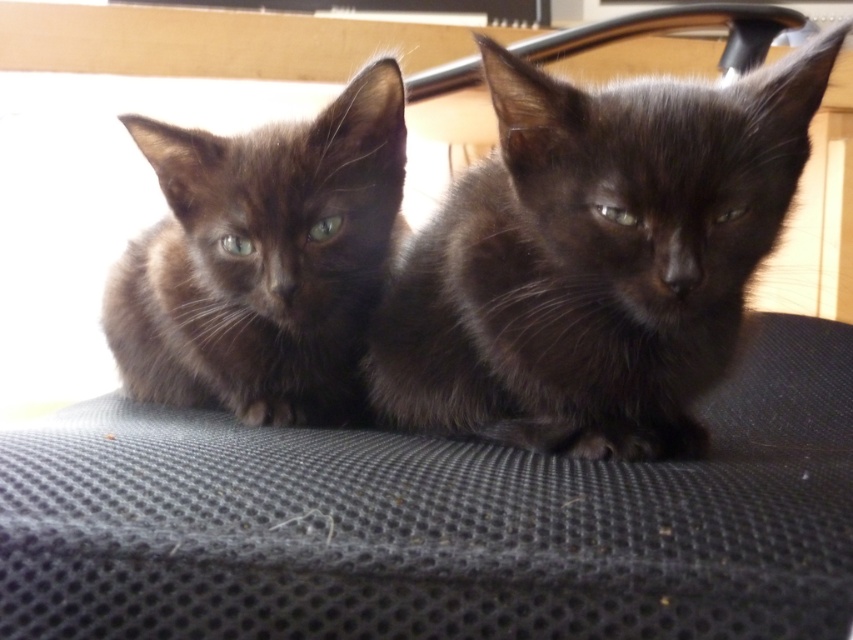
Can you confirm if shiny black kitten at center is bigger than shiny black kitten at left?

Yes.

You are a GUI agent. You are given a task and a screenshot of the screen. Output one action in this format:
    pyautogui.click(x=<x>, y=<y>)
    Task: Click on the shiny black kitten at center
    This screenshot has height=640, width=853.
    Given the screenshot: What is the action you would take?
    pyautogui.click(x=595, y=259)